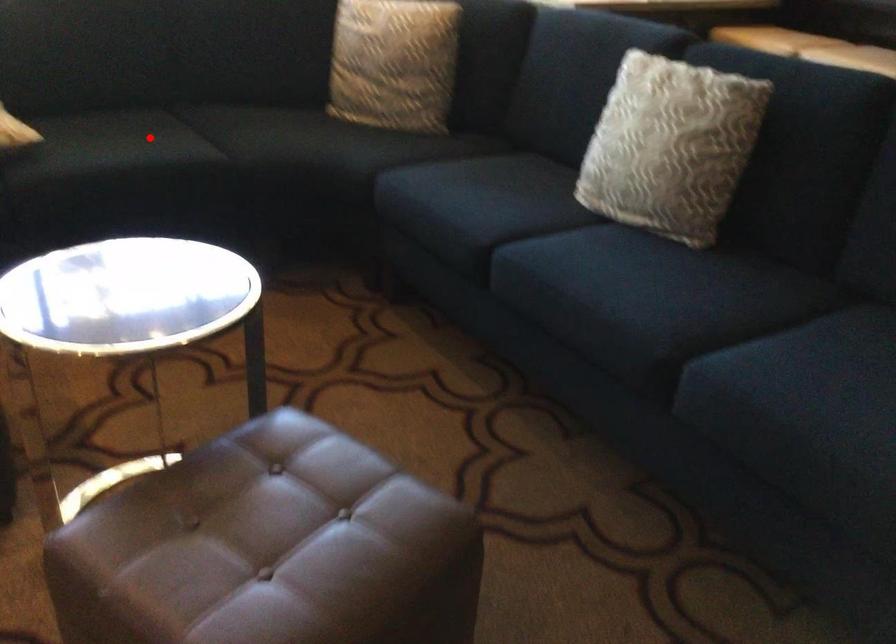
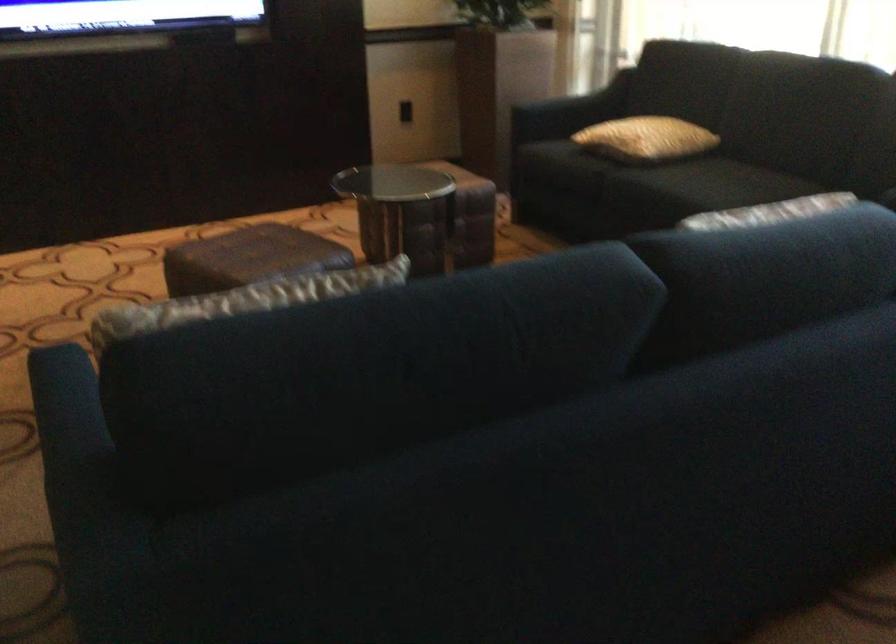
Locate, in the second image, the point that corresponds to the highlighted location in the first image.

(709, 184)